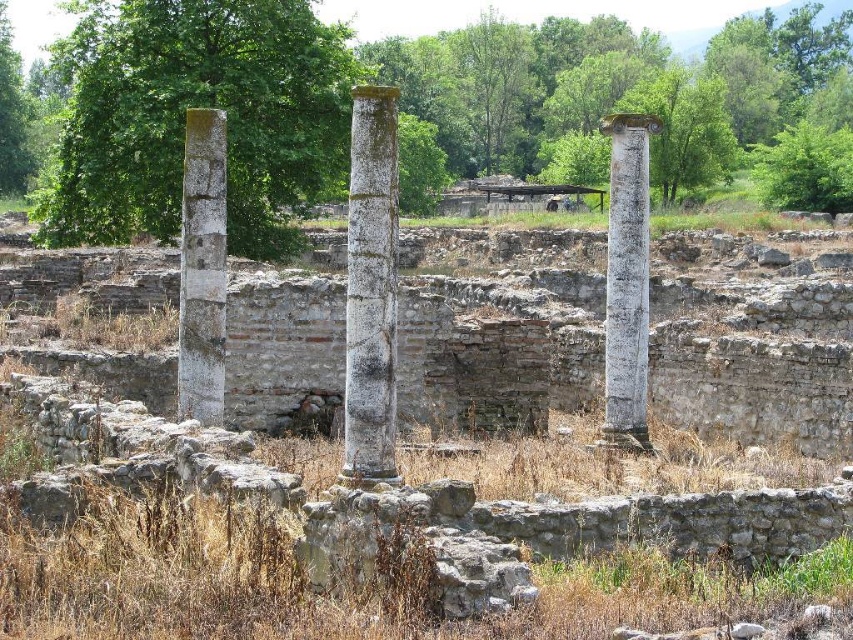
Question: Can you confirm if white marble column at center is positioned above white stone column at center?

Choices:
 (A) no
 (B) yes

Answer: (A)

Question: Is green leafy tree at upper center to the right of white marble column at center from the viewer's perspective?

Choices:
 (A) no
 (B) yes

Answer: (A)

Question: Considering the real-world distances, which object is closest to the gray stone column at left?

Choices:
 (A) white marble column at center
 (B) white stone column at center
 (C) green leafy tree at upper center

Answer: (A)

Question: Estimate the real-world distances between objects in this image. Which object is closer to the white stone column at center?

Choices:
 (A) green leafy tree at upper center
 (B) gray stone column at left
 (C) white marble column at center

Answer: (C)

Question: Which point is closer to the camera taking this photo?

Choices:
 (A) (350, 156)
 (B) (779, 132)
 (C) (160, 145)
 (D) (215, 403)

Answer: (D)

Question: Is green mossy column at center thinner than green leafy tree at upper right?

Choices:
 (A) no
 (B) yes

Answer: (B)